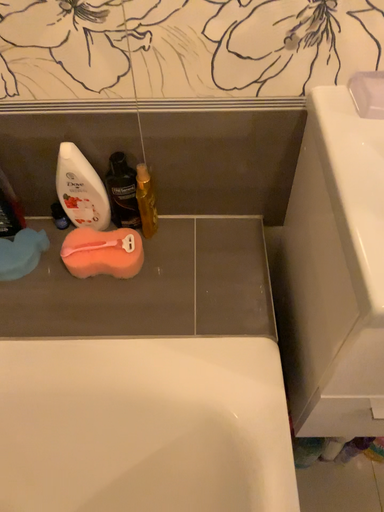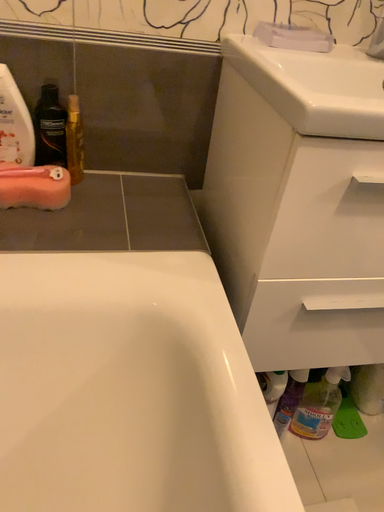
Question: Which way did the camera rotate in the video?

Choices:
 (A) rotated right
 (B) rotated left

Answer: (A)